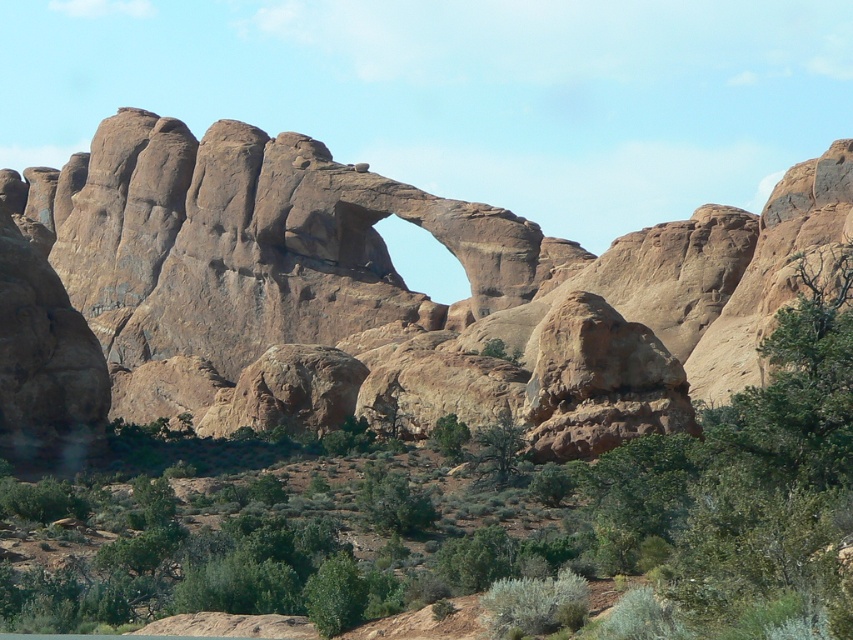
You are standing in front of the rustic sandstone arch at center and the green leafy shrubs at center. Which object is positioned to the right?

The green leafy shrubs at center are positioned to the right of the rustic sandstone arch at center.

Based on the photo, you are standing at the center of the image and want to locate the rustic sandstone arch at center. Based on the coordinates provided, in which direction should you look to find it?

The rustic sandstone arch at center is located at coordinates point (404,291), which is slightly to the right and slightly above the exact center point of the image. Therefore, you should look slightly to the right and slightly upward from the center to find it.

You are a hiker standing at the base of the rustic sandstone arch at center. You want to take a photo of the arch from a distance where it will appear smaller in the frame. Which direction should you move to achieve this?

To make the rustic sandstone arch at center appear smaller in the frame, you should move away from it. Since you are currently at the base, moving further away will increase the distance between you and the arch, making it appear smaller. The current distance is 125.19 meters, so moving further back would achieve the desired effect.